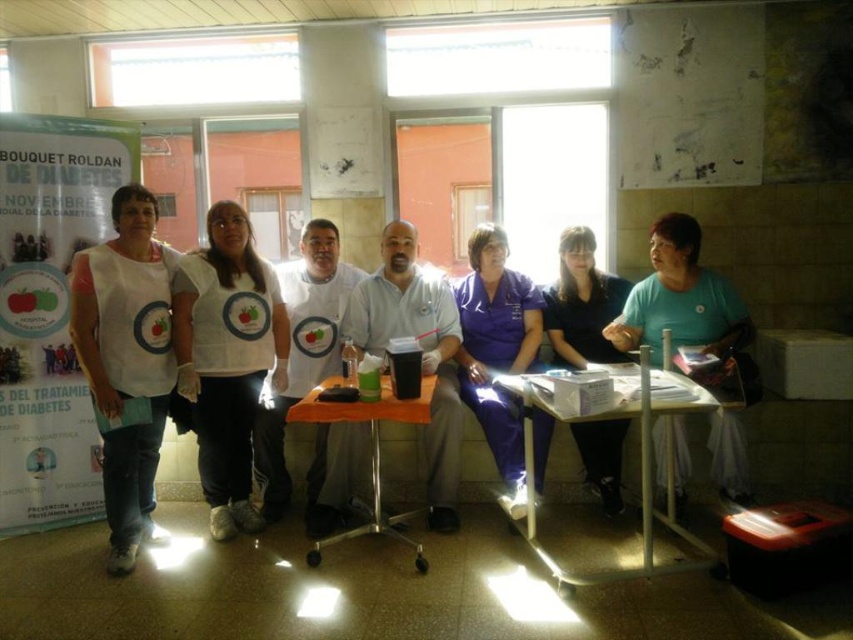
Between point (91, 376) and point (566, 589), which one is positioned in front?

Point (566, 589)

Is white fabric vest at left taller than white plastic table at lower center?

Indeed, white fabric vest at left has a greater height compared to white plastic table at lower center.

Between point (152, 353) and point (573, 552), which one is positioned behind?

Point (152, 353)

Identify the location of white fabric vest at left. The height and width of the screenshot is (640, 853). (126, 360).

Looking at this image, is white fabric vest at left wider than black fabric shirt at center?

No, white fabric vest at left is not wider than black fabric shirt at center.

Locate an element on the screen. white fabric vest at left is located at coordinates (126, 360).

Is point (160, 307) more distant than point (613, 465)?

No, (160, 307) is closer to viewer.

The width and height of the screenshot is (853, 640). I want to click on white fabric vest at left, so click(126, 360).

Is white paper poster at left wider than white fabric shirt at center?

Indeed, white paper poster at left has a greater width compared to white fabric shirt at center.

Which is above, white paper poster at left or white fabric shirt at center?

white paper poster at left

Does point (79, 195) come behind point (225, 307)?

Yes, point (79, 195) is behind point (225, 307).

The height and width of the screenshot is (640, 853). What are the coordinates of `white paper poster at left` in the screenshot? It's located at (50, 308).